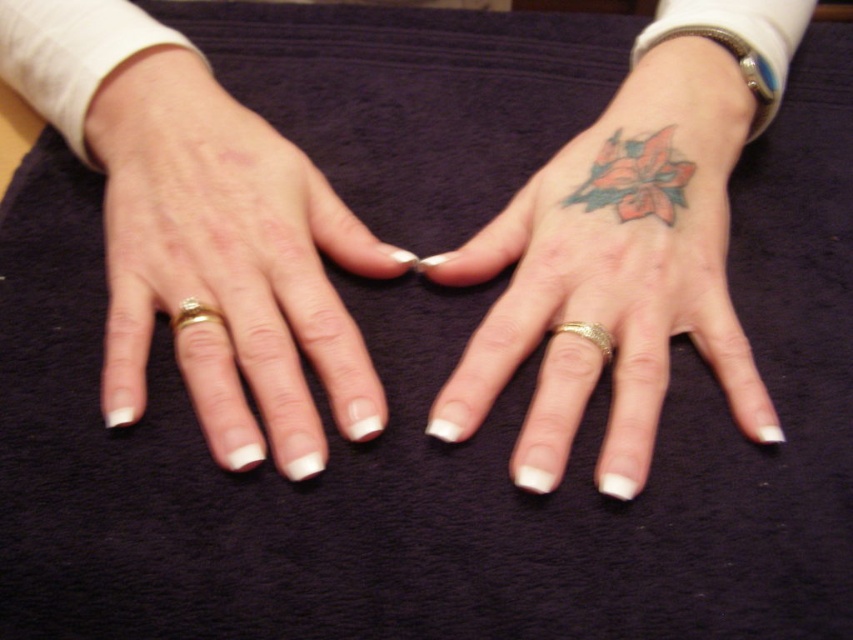
Which is below, colored tattoo at upper right or white matte ring at left?

white matte ring at left is below.

Is colored tattoo at upper right bigger than white matte ring at left?

Indeed, colored tattoo at upper right has a larger size compared to white matte ring at left.

This screenshot has width=853, height=640. Describe the element at coordinates (635, 230) in the screenshot. I see `colored tattoo at upper right` at that location.

Find the location of a particular element. This screenshot has height=640, width=853. colored tattoo at upper right is located at coordinates (635, 230).

Can you confirm if white matte ring at left is taller than gold metallic ring at left?

Indeed, white matte ring at left has a greater height compared to gold metallic ring at left.

Who is positioned more to the right, white matte ring at left or gold metallic ring at left?

white matte ring at left

Where is `white matte ring at left`? The image size is (853, 640). white matte ring at left is located at coordinates (228, 266).

The image size is (853, 640). I want to click on white matte ring at left, so click(228, 266).

Who is shorter, colored tattoo at upper right or gold metallic ring at left?

With less height is gold metallic ring at left.

Which is more to the right, colored tattoo at upper right or gold metallic ring at left?

From the viewer's perspective, colored tattoo at upper right appears more on the right side.

Who is more distant from viewer, [660,312] or [181,328]?

The point [660,312] is more distant.

Where is `colored tattoo at upper right`? The width and height of the screenshot is (853, 640). colored tattoo at upper right is located at coordinates (635, 230).